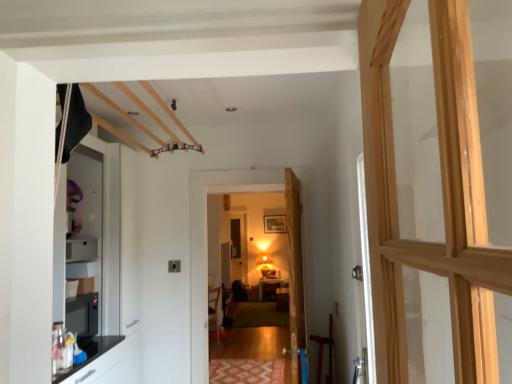
Question: Considering the relative sizes of matte wooden chair at center and wooden door at center, the first door positioned from the back, in the image provided, is matte wooden chair at center shorter than wooden door at center, the first door positioned from the back,?

Choices:
 (A) yes
 (B) no

Answer: (A)

Question: Is matte wooden chair at center touching wooden door at center, the 2th door when ordered from front to back?

Choices:
 (A) no
 (B) yes

Answer: (A)

Question: Is matte wooden chair at center at the left side of wooden door at center, the first door positioned from the back?

Choices:
 (A) yes
 (B) no

Answer: (A)

Question: Considering the relative sizes of matte wooden chair at center and wooden door at center, the first door positioned from the back, in the image provided, is matte wooden chair at center smaller than wooden door at center, the first door positioned from the back,?

Choices:
 (A) yes
 (B) no

Answer: (A)

Question: Does matte wooden chair at center have a greater height compared to wooden door at center, the first door positioned from the back?

Choices:
 (A) yes
 (B) no

Answer: (B)

Question: Is matte wooden chair at center situated inside wooden door at center, the 2th door when ordered from front to back, or outside?

Choices:
 (A) inside
 (B) outside

Answer: (B)

Question: Relative to wooden door at center, the first door positioned from the back, is matte wooden chair at center in front or behind?

Choices:
 (A) front
 (B) behind

Answer: (B)

Question: From a real-world perspective, is matte wooden chair at center above or below wooden door at center, the first door positioned from the back?

Choices:
 (A) above
 (B) below

Answer: (B)

Question: Based on their positions, is matte wooden chair at center located to the left or right of wooden door at center, the first door positioned from the back?

Choices:
 (A) right
 (B) left

Answer: (B)

Question: Visually, is wooden door at center, the first door positioned from the back, positioned to the left or to the right of patterned carpet at center?

Choices:
 (A) right
 (B) left

Answer: (A)

Question: Is point (196, 261) closer or farther from the camera than point (265, 364)?

Choices:
 (A) closer
 (B) farther

Answer: (A)

Question: Considering the positions of wooden door at center, the first door positioned from the back, and patterned carpet at center in the image, is wooden door at center, the first door positioned from the back, taller or shorter than patterned carpet at center?

Choices:
 (A) short
 (B) tall

Answer: (B)

Question: From the image's perspective, is wooden door at center, the 2th door when ordered from front to back, positioned above or below patterned carpet at center?

Choices:
 (A) above
 (B) below

Answer: (A)

Question: From the image's perspective, relative to wooden door at center, marked as the second door in a back-to-front arrangement, is matte wooden table at center above or below?

Choices:
 (A) below
 (B) above

Answer: (A)

Question: Is matte wooden table at center bigger or smaller than wooden door at center, marked as the second door in a back-to-front arrangement?

Choices:
 (A) small
 (B) big

Answer: (A)